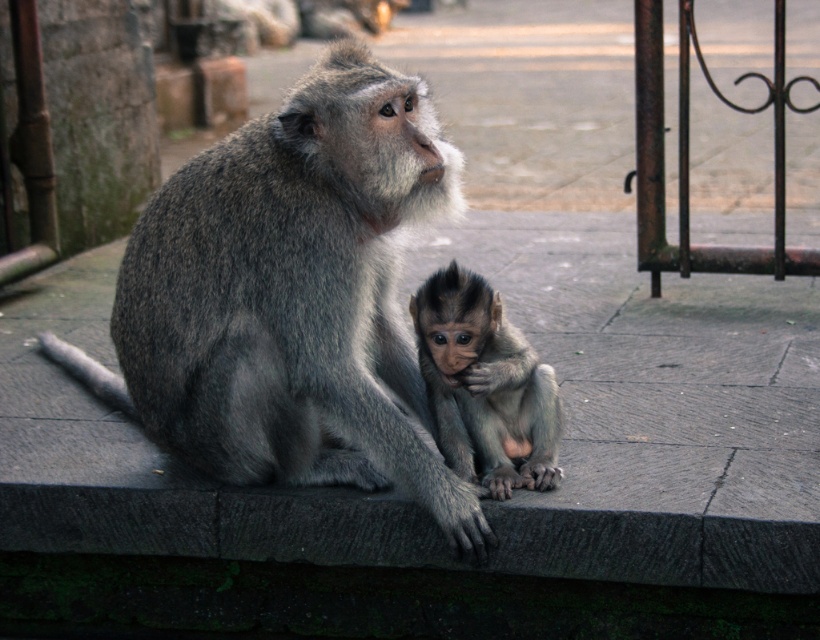
Does gray furry monkey at center have a smaller size compared to soft gray fur monkey at center?

No, gray furry monkey at center is not smaller than soft gray fur monkey at center.

Who is shorter, gray furry monkey at center or soft gray fur monkey at center?

soft gray fur monkey at center

What do you see at coordinates (290, 296) in the screenshot? I see `gray furry monkey at center` at bounding box center [290, 296].

Identify the location of gray furry monkey at center. (290, 296).